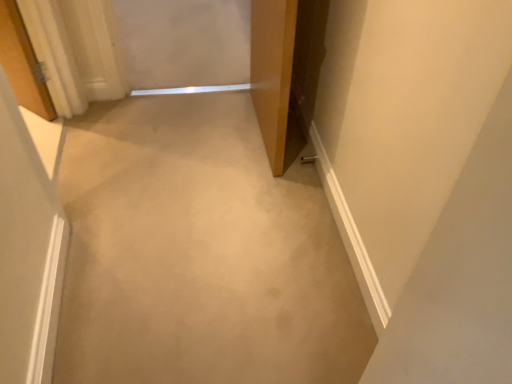
Question: From a real-world perspective, is beige carpet at center positioned under wooden door at center based on gravity?

Choices:
 (A) yes
 (B) no

Answer: (A)

Question: Is beige carpet at center placed right next to wooden door at center?

Choices:
 (A) yes
 (B) no

Answer: (B)

Question: Considering the relative sizes of beige carpet at center and wooden door at center in the image provided, is beige carpet at center shorter than wooden door at center?

Choices:
 (A) no
 (B) yes

Answer: (B)

Question: From the image's perspective, would you say beige carpet at center is positioned over wooden door at center?

Choices:
 (A) no
 (B) yes

Answer: (A)

Question: Is beige carpet at center further to camera compared to wooden door at center?

Choices:
 (A) no
 (B) yes

Answer: (A)

Question: Can you confirm if beige carpet at center is bigger than wooden door at center?

Choices:
 (A) no
 (B) yes

Answer: (A)

Question: Considering the relative sizes of wooden door at center and beige carpet at center in the image provided, is wooden door at center shorter than beige carpet at center?

Choices:
 (A) yes
 (B) no

Answer: (B)

Question: Is wooden door at center in contact with beige carpet at center?

Choices:
 (A) yes
 (B) no

Answer: (B)

Question: Is wooden door at center aimed at beige carpet at center?

Choices:
 (A) no
 (B) yes

Answer: (B)

Question: Does wooden door at center have a larger size compared to beige carpet at center?

Choices:
 (A) yes
 (B) no

Answer: (A)

Question: Can you confirm if wooden door at center is positioned to the left of beige carpet at center?

Choices:
 (A) yes
 (B) no

Answer: (B)

Question: Is beige carpet at center at the back of wooden door at center?

Choices:
 (A) yes
 (B) no

Answer: (B)

Question: Do you think beige carpet at center is within wooden door at center, or outside of it?

Choices:
 (A) outside
 (B) inside

Answer: (A)